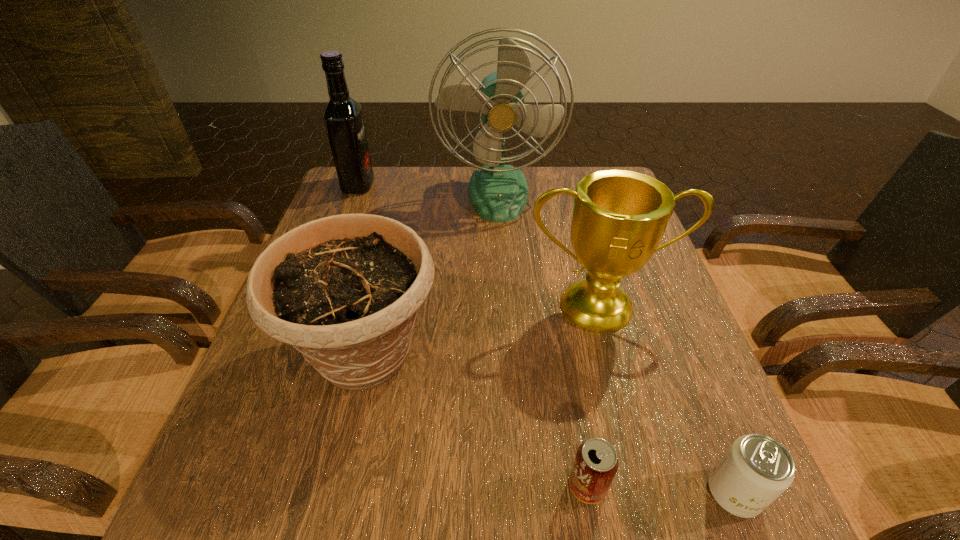
The height and width of the screenshot is (540, 960). What are the coordinates of `vacant space that is in between the fifth shortest object and the tallest object` in the screenshot? It's located at (428, 190).

Locate an element on the screen. The width and height of the screenshot is (960, 540). blank region between the third tallest object and the tallest object is located at coordinates (548, 250).

At what (x,y) coordinates should I click in order to perform the action: click on free space between the left soda can and the flowerpot. Please return your answer as a coordinate pair (x, y). Looking at the image, I should click on (476, 420).

Choose which object is the fourth nearest neighbor to the liquor. Please provide its 2D coordinates. Your answer should be formatted as a tuple, i.e. [(x, y)], where the tuple contains the x and y coordinates of a point satisfying the conditions above.

[(596, 462)]

Identify which object is the closest to the left soda can. Please provide its 2D coordinates. Your answer should be formatted as a tuple, i.e. [(x, y)], where the tuple contains the x and y coordinates of a point satisfying the conditions above.

[(756, 469)]

Where is `free spot that satisfies the following two spatial constraints: 1. on the front-facing side of the left soda can; 2. on the right side of the liquor`? The image size is (960, 540). free spot that satisfies the following two spatial constraints: 1. on the front-facing side of the left soda can; 2. on the right side of the liquor is located at coordinates (244, 486).

At what (x,y) coordinates should I click in order to perform the action: click on free space that satisfies the following two spatial constraints: 1. on the shiny surface of the right soda can; 2. on the right side of the fourth shortest object. Please return your answer as a coordinate pair (x, y). The image size is (960, 540). Looking at the image, I should click on (649, 493).

Find the location of a particular element. The width and height of the screenshot is (960, 540). vacant space that satisfies the following two spatial constraints: 1. on the front-facing side of the liquor; 2. on the back side of the third shortest object is located at coordinates (294, 355).

The width and height of the screenshot is (960, 540). In order to click on blank area in the image that satisfies the following two spatial constraints: 1. in front of the tallest object, directing airflow; 2. on the right side of the right soda can in this screenshot , I will do `click(515, 493)`.